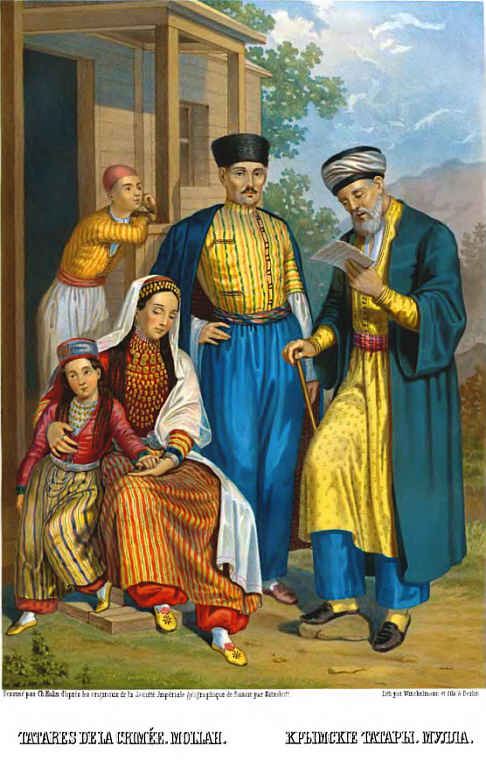
You are a GUI agent. You are given a task and a screenshot of the screen. Output one action in this format:
    pyautogui.click(x=<x>, y=<y>)
    Task: Click on the sock
    The height and width of the screenshot is (760, 486).
    Given the screenshot: What is the action you would take?
    pyautogui.click(x=212, y=632)